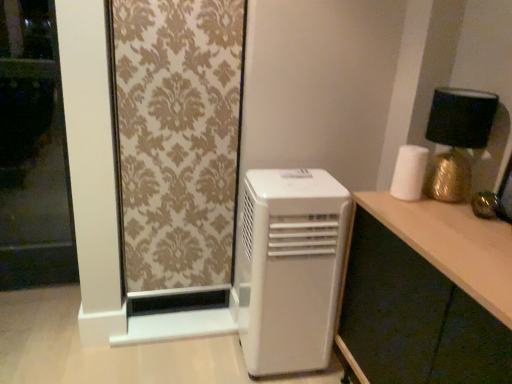
Identify the location of spots to the right of white matte paper towel at right. The width and height of the screenshot is (512, 384). coord(448,204).